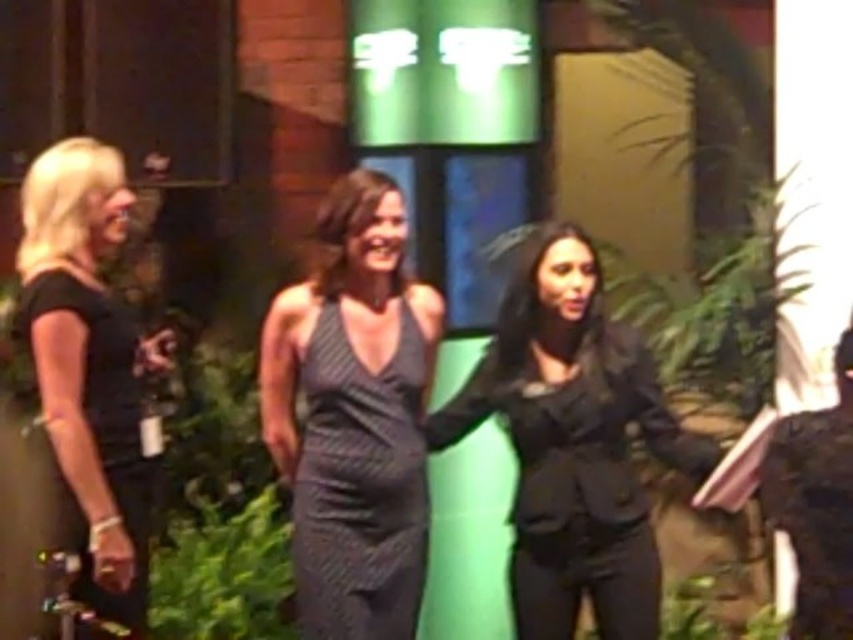
Question: Which point is farther to the camera?

Choices:
 (A) (83, 316)
 (B) (846, 429)
 (C) (357, 481)
 (D) (509, 305)

Answer: (D)

Question: Which point is closer to the camera?

Choices:
 (A) black matte blazer at center
 (B) black textured dress at center
 (C) black matte dress at left
 (D) dark brown leather jacket at right

Answer: (D)

Question: Considering the real-world distances, which object is farthest from the black matte dress at left?

Choices:
 (A) dark brown leather jacket at right
 (B) black matte blazer at center

Answer: (A)

Question: Is black matte blazer at center thinner than black textured dress at center?

Choices:
 (A) yes
 (B) no

Answer: (B)

Question: Does black matte blazer at center have a larger size compared to black matte dress at left?

Choices:
 (A) yes
 (B) no

Answer: (B)

Question: Is black textured dress at center wider than dark brown leather jacket at right?

Choices:
 (A) no
 (B) yes

Answer: (B)